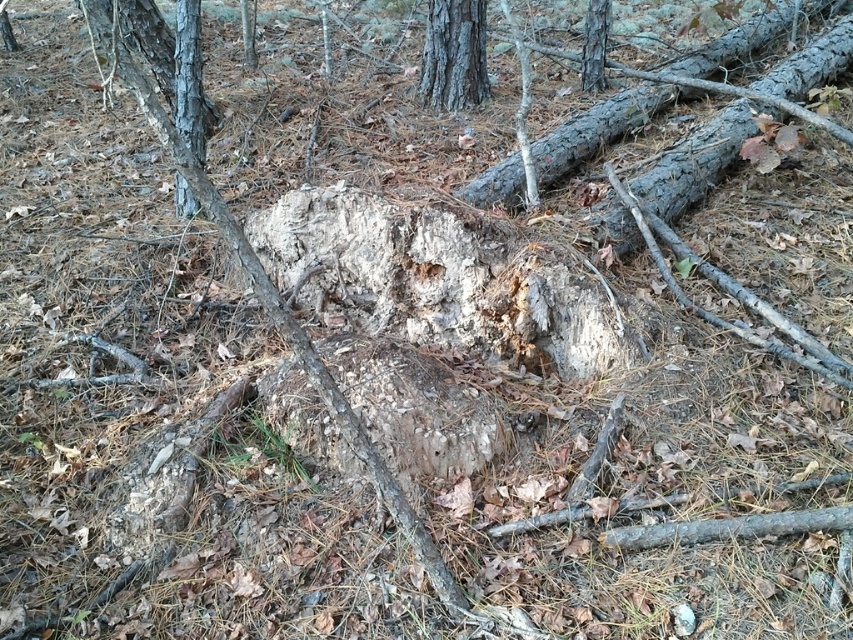
Question: Which point is closer to the camera?

Choices:
 (A) (479, 33)
 (B) (152, 99)

Answer: (B)

Question: Considering the real-world distances, which object is closest to the smooth gray bark tree at upper center?

Choices:
 (A) smooth bark tree trunk at left
 (B) smooth bark tree at upper center

Answer: (B)

Question: Is smooth gray bark tree at upper center closer to the viewer compared to smooth bark tree at upper center?

Choices:
 (A) no
 (B) yes

Answer: (B)

Question: Considering the relative positions of rough bark tree trunk at center and smooth bark tree trunk at left in the image provided, where is rough bark tree trunk at center located with respect to smooth bark tree trunk at left?

Choices:
 (A) left
 (B) right

Answer: (B)

Question: Does smooth bark tree trunk at left appear under smooth bark tree at upper center?

Choices:
 (A) yes
 (B) no

Answer: (A)

Question: Which point is farther to the camera?

Choices:
 (A) (463, 22)
 (B) (177, 141)

Answer: (A)